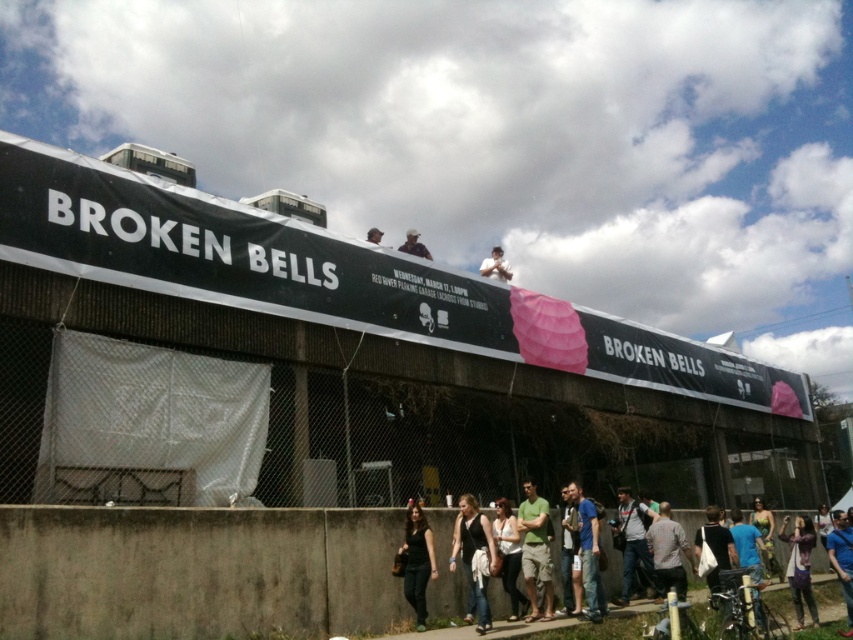
Question: Is the position of black leather jacket at center less distant than that of matte black camera at upper center?

Choices:
 (A) no
 (B) yes

Answer: (B)

Question: Which object is closer to the camera taking this photo?

Choices:
 (A) green cotton t-shirt at center
 (B) gray cotton shirt at lower right
 (C) blue cotton shirt at center
 (D) matte black camera at upper center

Answer: (C)

Question: Where is green cotton t-shirt at center located in relation to dark blue shirt at center in the image?

Choices:
 (A) below
 (B) above

Answer: (B)

Question: Based on their relative distances, which object is farther from the green cotton t-shirt at center?

Choices:
 (A) denim jacket at lower right
 (B) matte black hat at upper center
 (C) black casual clothing at lower center

Answer: (B)

Question: Can you confirm if green cotton t-shirt at center is wider than matte black camera at upper center?

Choices:
 (A) no
 (B) yes

Answer: (A)

Question: Which object is positioned closest to the green cotton t-shirt at center?

Choices:
 (A) black casual clothing at lower center
 (B) denim jacket at lower right

Answer: (A)